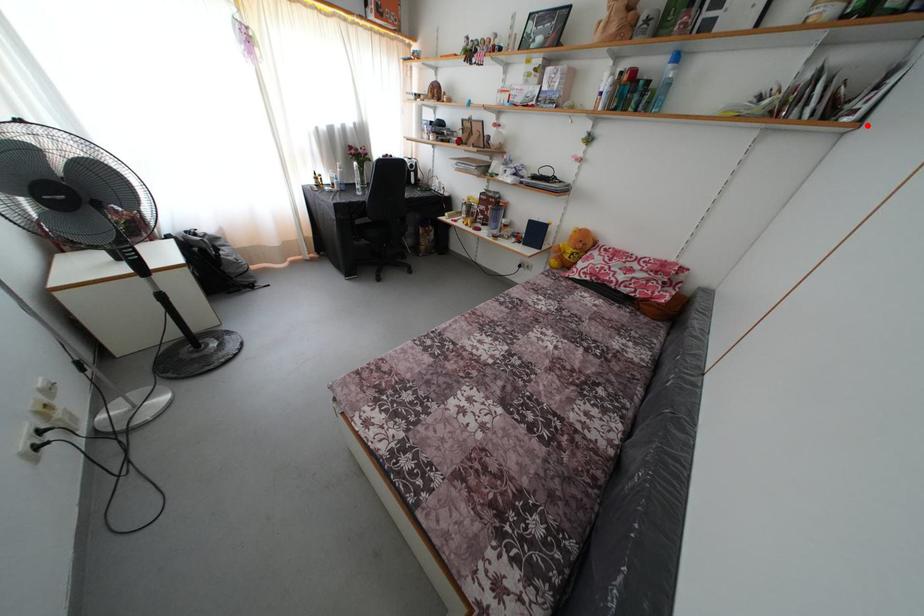
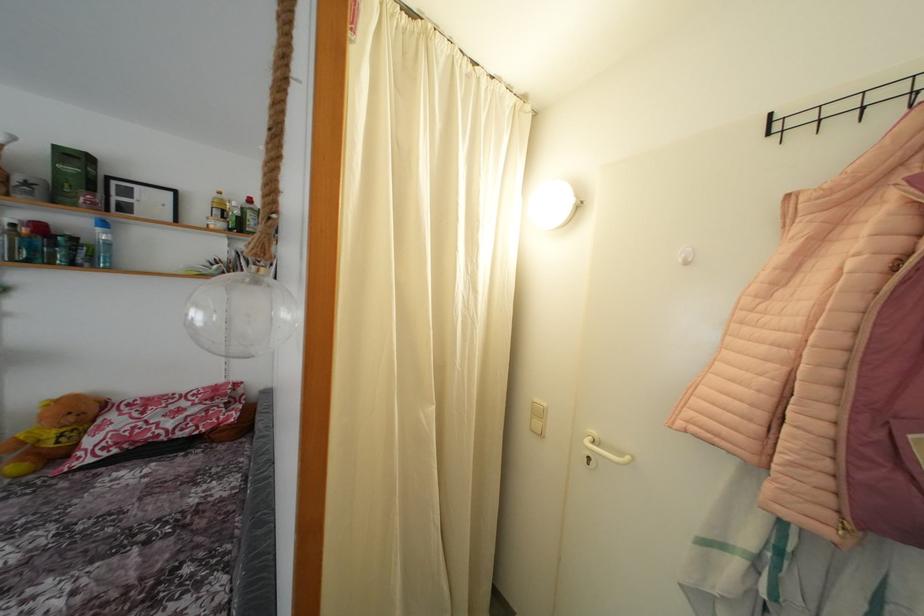
Where in the second image is the point corresponding to the highlighted location from the first image?

(281, 286)